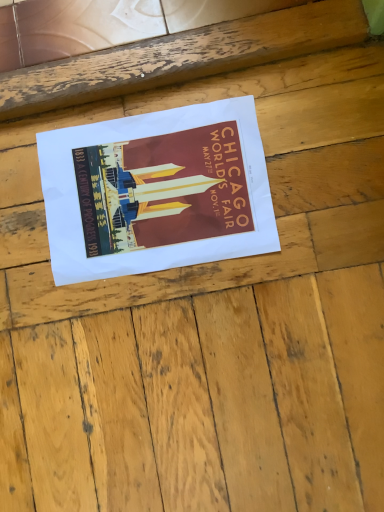
I want to click on free space above matte paper poster at center (from a real-world perspective), so click(x=155, y=195).